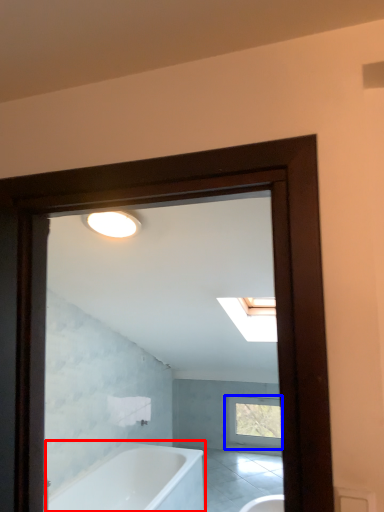
Question: Among these objects, which one is farthest to the camera, bathtub (highlighted by a red box) or window (highlighted by a blue box)?

Choices:
 (A) bathtub
 (B) window

Answer: (B)